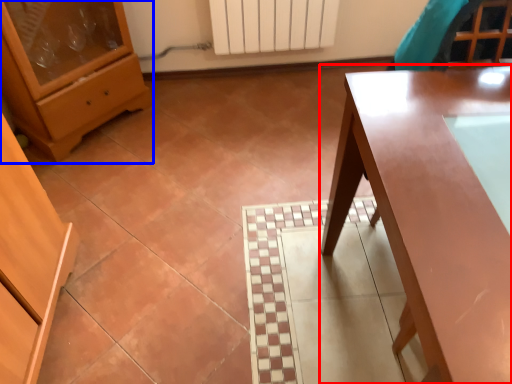
Question: Which object is further to the camera taking this photo, table (highlighted by a red box) or chest of drawers (highlighted by a blue box)?

Choices:
 (A) table
 (B) chest of drawers

Answer: (B)